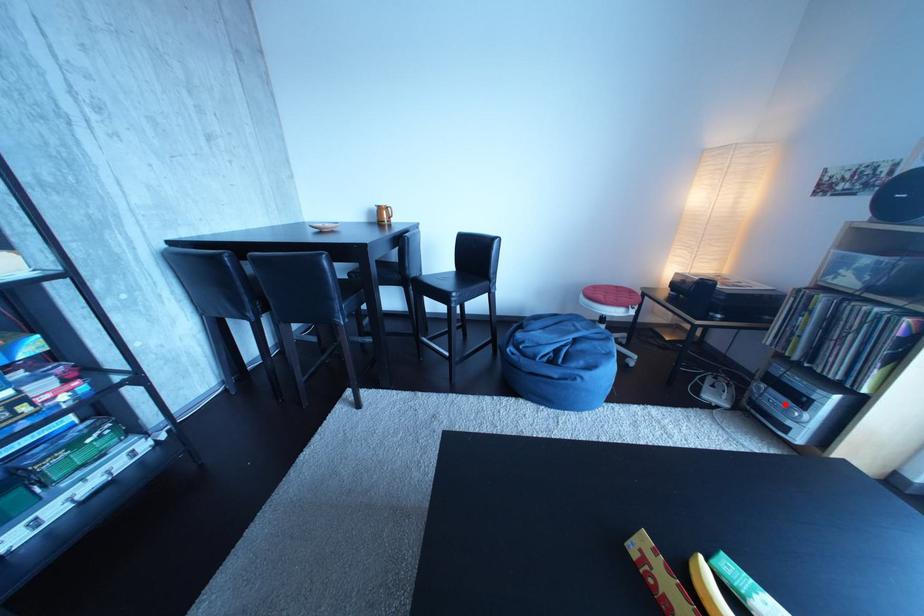
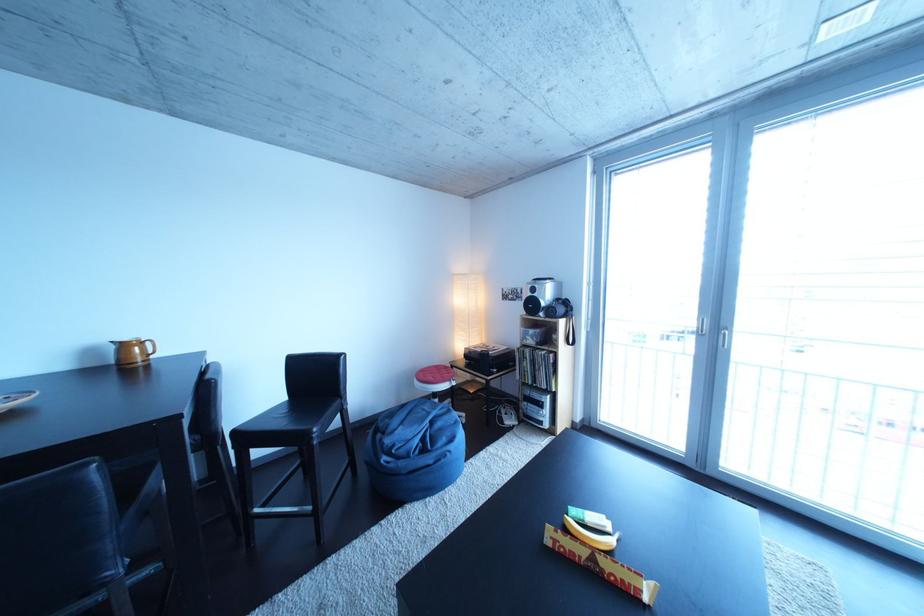
Locate, in the second image, the point that corresponds to the highlighted location in the first image.

(543, 415)